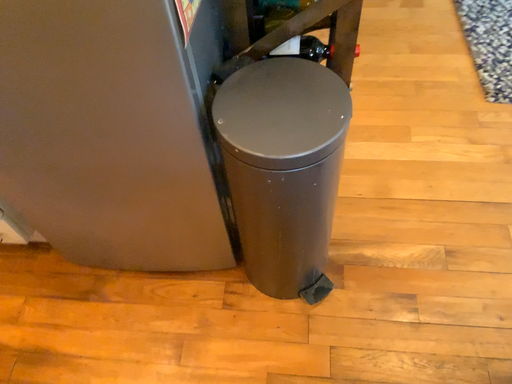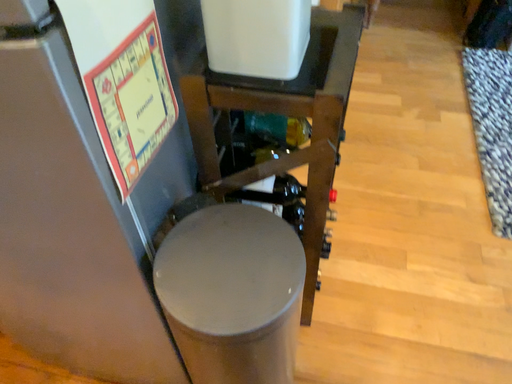
Question: How did the camera likely rotate when shooting the video?

Choices:
 (A) rotated downward
 (B) rotated upward

Answer: (B)